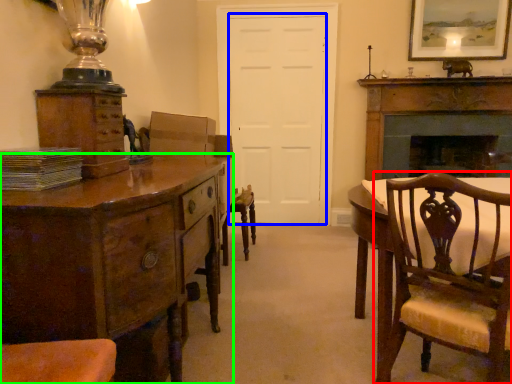
Question: Which object is the closest to the chair (highlighted by a red box)? Choose among these: door (highlighted by a blue box) or chest of drawers (highlighted by a green box).

Choices:
 (A) door
 (B) chest of drawers

Answer: (B)